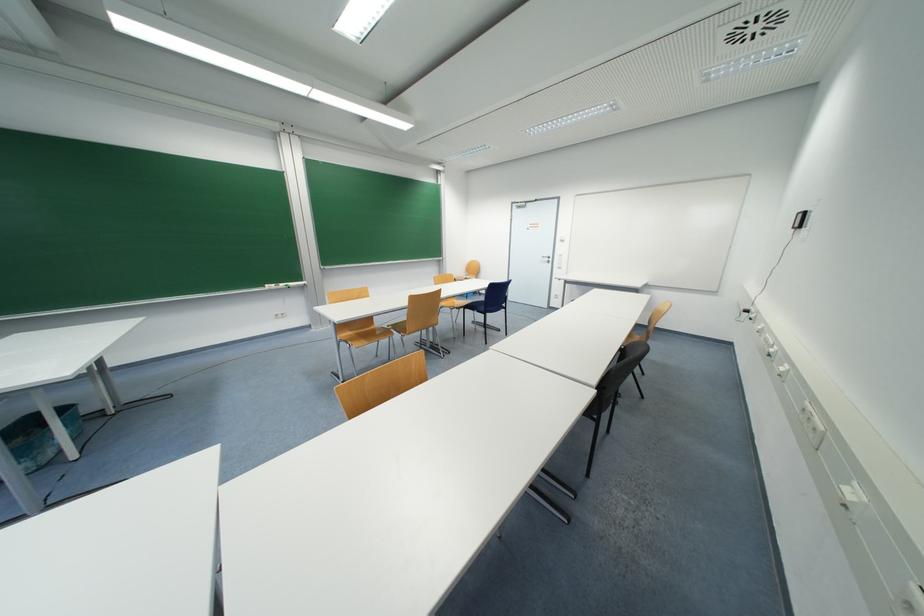
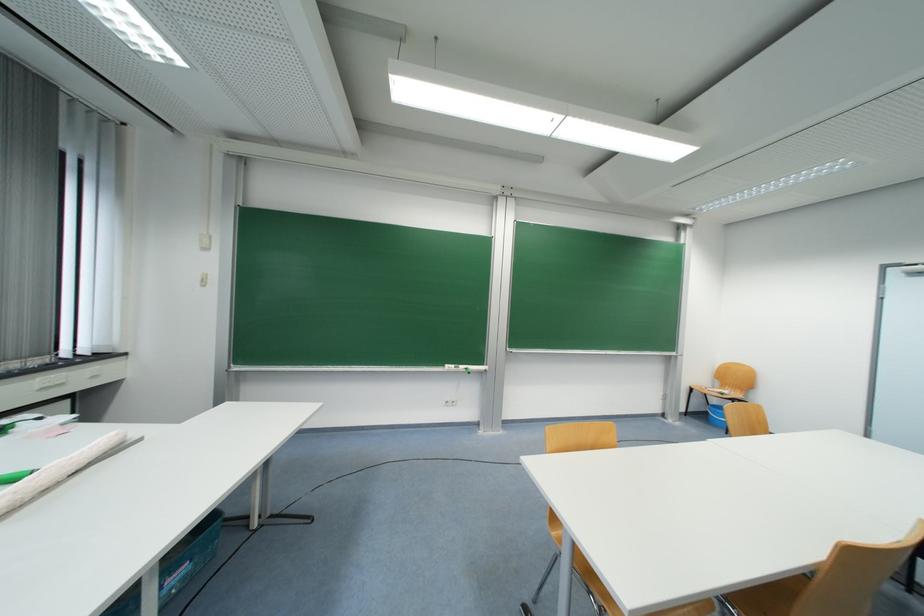
Where in the second image is the point corresponding to pixel 286 286 from the first image?

(467, 369)